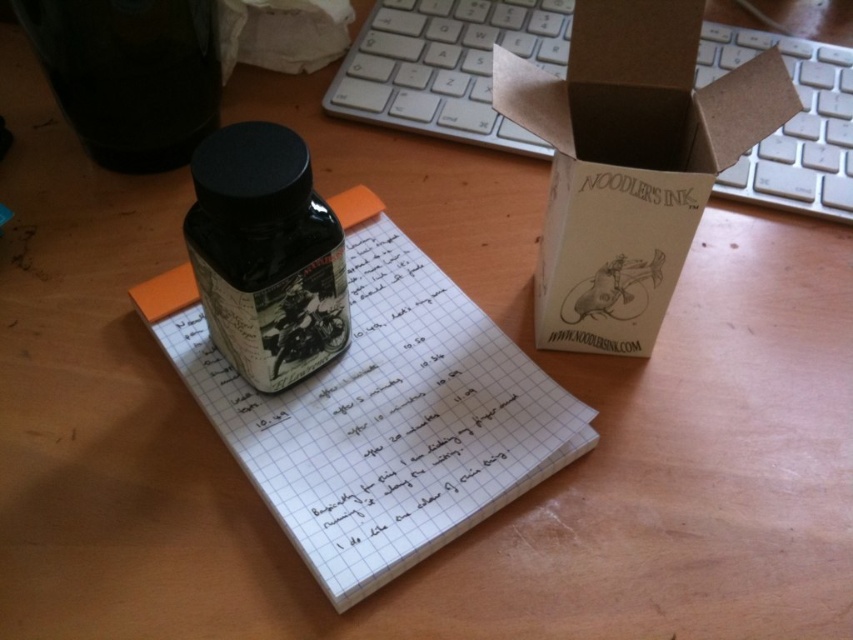
Question: Does white grid paper at center have a greater width compared to matte glass bottle at center?

Choices:
 (A) no
 (B) yes

Answer: (B)

Question: Which object appears farthest from the camera in this image?

Choices:
 (A) brown cardboard box at center
 (B) white paper at upper center
 (C) matte glass bottle at center
 (D) white plastic keyboard at upper center

Answer: (D)

Question: Which point is farther to the camera?

Choices:
 (A) (791, 132)
 (B) (305, 384)
 (C) (595, 330)
 (D) (96, 44)

Answer: (A)

Question: Which of these objects is positioned farthest from the white plastic keyboard at upper center?

Choices:
 (A) matte glass bottle at center
 (B) brown cardboard box at center

Answer: (A)

Question: Is white grid paper at center closer to camera compared to matte glass bottle at center?

Choices:
 (A) no
 (B) yes

Answer: (A)

Question: Is white grid paper at center below brown cardboard box at center?

Choices:
 (A) no
 (B) yes

Answer: (B)